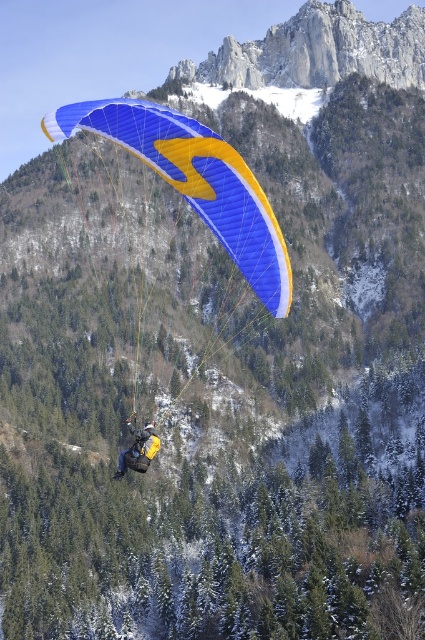
You are a photographer trying to capture the paraglider scene. You notice two parachutes in the sky, the blue fabric parachute at center and the yellow fabric parachute at center. Which one would appear bigger in your photo?

The blue fabric parachute at center appears bigger in the photo because it is larger in size than the yellow fabric parachute at center.

You are a paraglider pilot preparing to land. You see the point at coordinates point (x=240, y=198). Is this point within a safe distance for landing? Please explain your reasoning.

The point at coordinates point (x=240, y=198) is 185.35 feet from the viewer. Since this distance is within the recommended landing zone range for paragliders, which typically requires a minimum of 150 feet for a safe landing, this point is within a safe distance for landing.

You are a pilot navigating a paraglider and need to determine the best path between two points. The first point is at coordinates point (56, 136) and the second is at point (152, 426). Based on the image, which point is closer to you, the pilot, to help plan your route?

Point (56, 136) is closer to the viewer than point (152, 426), so you should plan your route starting from the closer point first.